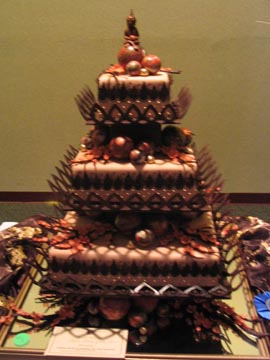
I want to click on table cloth, so click(21, 240), click(265, 251).